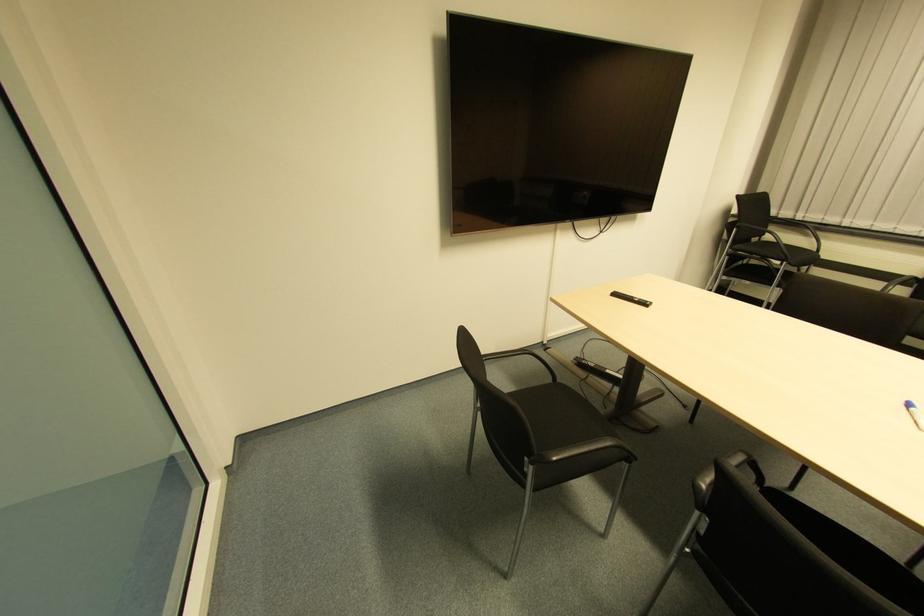
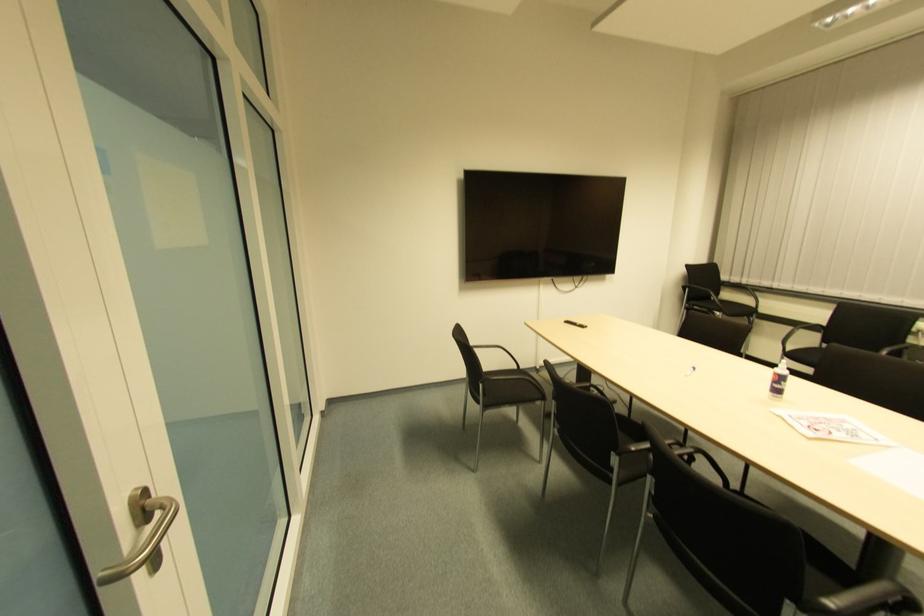
From the picture: What movement of the cameraman would produce the second image?

The cameraman walked toward right, backward.